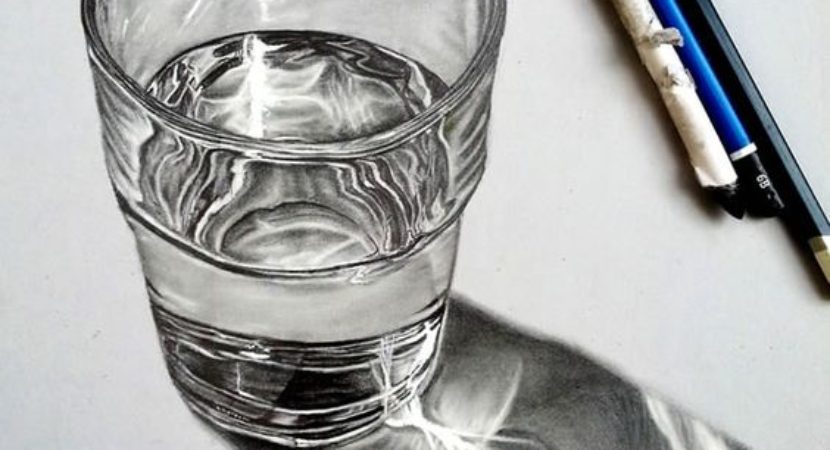
Where is `table`? This screenshot has height=450, width=830. table is located at coordinates (671, 292).